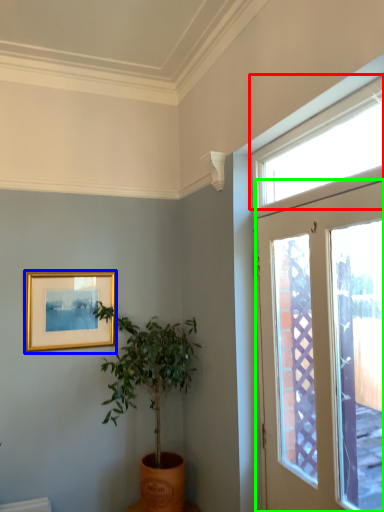
Question: Estimate the real-world distances between objects in this image. Which object is closer to window (highlighted by a red box), picture frame (highlighted by a blue box) or door (highlighted by a green box)?

Choices:
 (A) picture frame
 (B) door

Answer: (B)